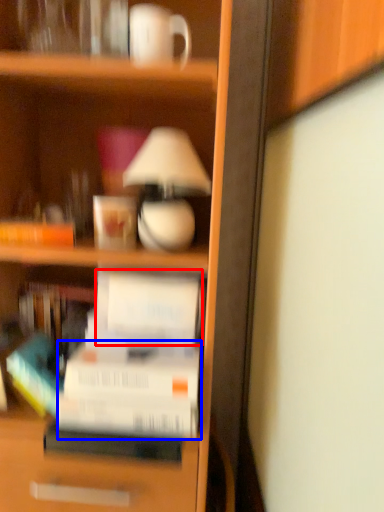
Question: Which object appears farthest to the camera in this image, paperback book (highlighted by a red box) or paperback book (highlighted by a blue box)?

Choices:
 (A) paperback book
 (B) paperback book

Answer: (A)